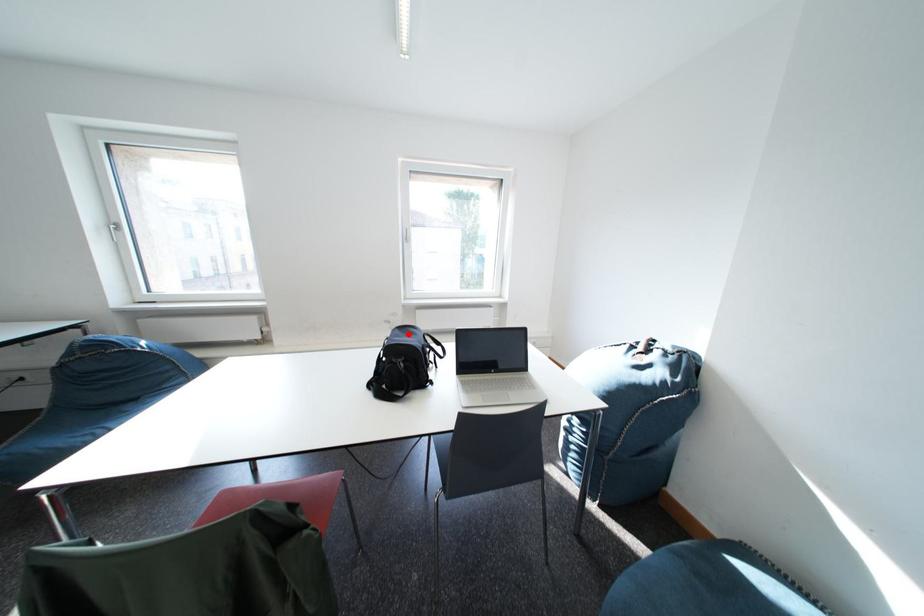
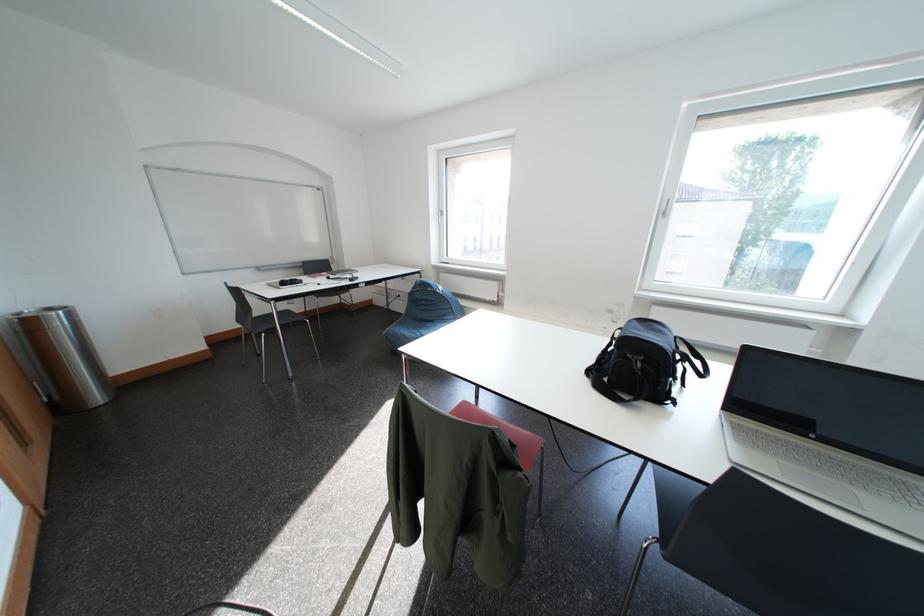
In the second image, find the point that corresponds to the highlighted location in the first image.

(648, 326)